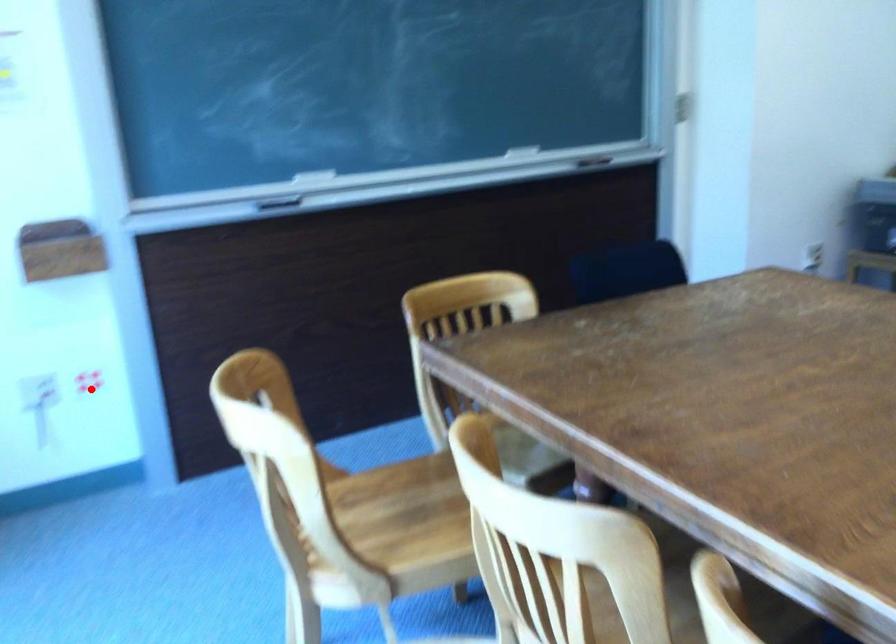
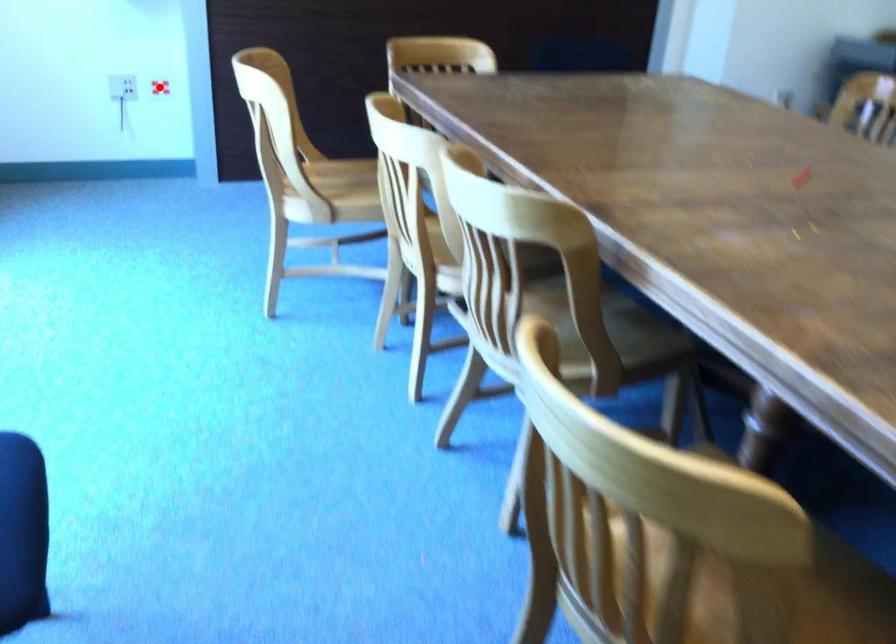
I am providing you with two images of the same scene from different viewpoints. A red point is marked on the first image and another point is marked on the second image. Do the highlighted points in image1 and image2 indicate the same real-world spot?

Yes